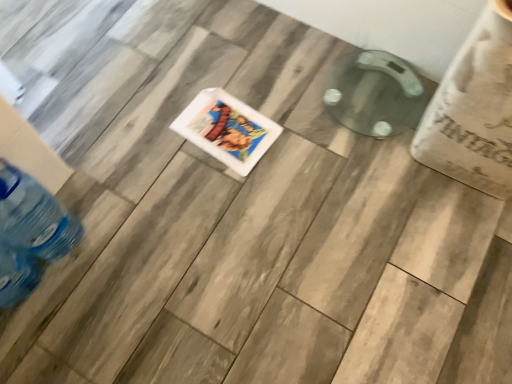
I want to click on vacant space in front of translucent plastic bottle at lower left, so click(69, 313).